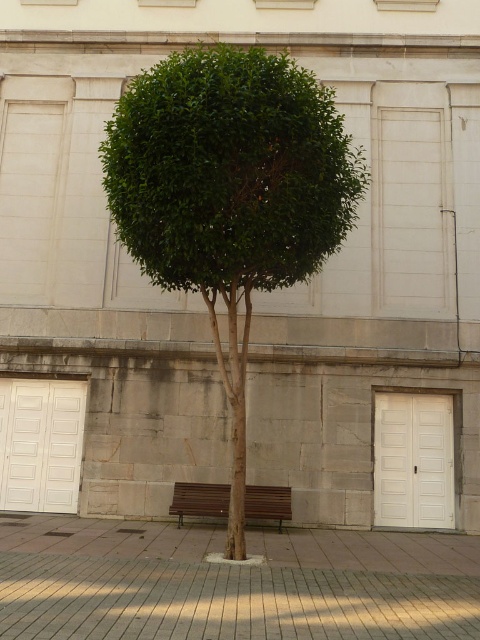
Question: Which of the following is the closest to the observer?

Choices:
 (A) white matte door at lower right
 (B) green leafy tree at center
 (C) brown wooden bench at center

Answer: (B)

Question: Does white glossy door at left appear on the left side of white matte door at lower right?

Choices:
 (A) no
 (B) yes

Answer: (B)

Question: Does white glossy door at left come behind brown wooden bench at center?

Choices:
 (A) no
 (B) yes

Answer: (B)

Question: Does white glossy door at left have a lesser width compared to white matte door at lower right?

Choices:
 (A) yes
 (B) no

Answer: (B)

Question: Which is farther from the brown wooden bench at center?

Choices:
 (A) white matte door at lower right
 (B) green leafy tree at center
 (C) white glossy door at left

Answer: (B)

Question: Among these points, which one is nearest to the camera?

Choices:
 (A) (9, 433)
 (B) (211, 486)

Answer: (B)